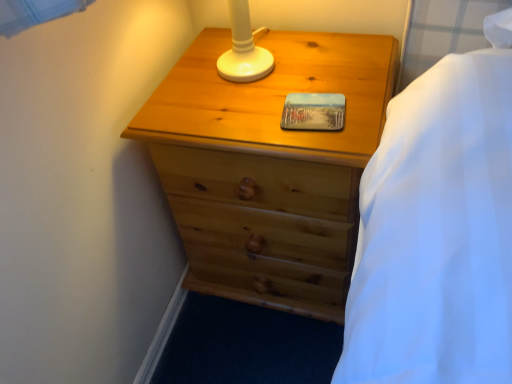
Question: Is metallic photo frame at center closer to the viewer compared to natural wood chest of drawers at center?

Choices:
 (A) yes
 (B) no

Answer: (B)

Question: Considering the relative positions of metallic photo frame at center and natural wood chest of drawers at center in the image provided, is metallic photo frame at center behind natural wood chest of drawers at center?

Choices:
 (A) yes
 (B) no

Answer: (A)

Question: Is metallic photo frame at center in contact with natural wood chest of drawers at center?

Choices:
 (A) no
 (B) yes

Answer: (A)

Question: Is metallic photo frame at center aimed at natural wood chest of drawers at center?

Choices:
 (A) no
 (B) yes

Answer: (B)

Question: Considering the relative sizes of metallic photo frame at center and natural wood chest of drawers at center in the image provided, is metallic photo frame at center taller than natural wood chest of drawers at center?

Choices:
 (A) yes
 (B) no

Answer: (B)

Question: Is metallic photo frame at center wider than natural wood chest of drawers at center?

Choices:
 (A) no
 (B) yes

Answer: (A)

Question: Does natural wood chest of drawers at center have a greater height compared to metallic photo frame at center?

Choices:
 (A) yes
 (B) no

Answer: (A)

Question: Is natural wood chest of drawers at center positioned with its back to metallic photo frame at center?

Choices:
 (A) no
 (B) yes

Answer: (A)

Question: From the image's perspective, is natural wood chest of drawers at center under metallic photo frame at center?

Choices:
 (A) no
 (B) yes

Answer: (B)

Question: Is metallic photo frame at center inside natural wood chest of drawers at center?

Choices:
 (A) yes
 (B) no

Answer: (A)

Question: Can you confirm if natural wood chest of drawers at center is wider than metallic photo frame at center?

Choices:
 (A) no
 (B) yes

Answer: (B)

Question: Is natural wood chest of drawers at center shorter than metallic photo frame at center?

Choices:
 (A) no
 (B) yes

Answer: (A)

Question: From the image's perspective, is metallic photo frame at center above or below natural wood chest of drawers at center?

Choices:
 (A) above
 (B) below

Answer: (A)